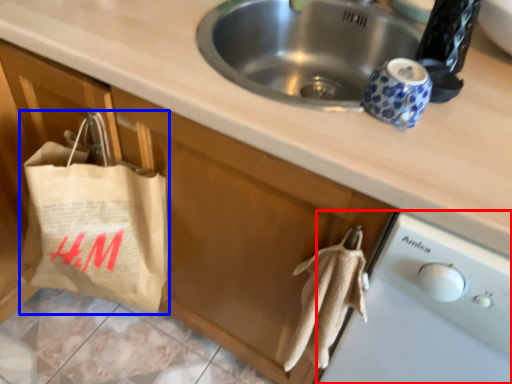
Question: Which object appears farthest to the camera in this image, dish washer (highlighted by a red box) or grocery bag (highlighted by a blue box)?

Choices:
 (A) dish washer
 (B) grocery bag

Answer: (B)